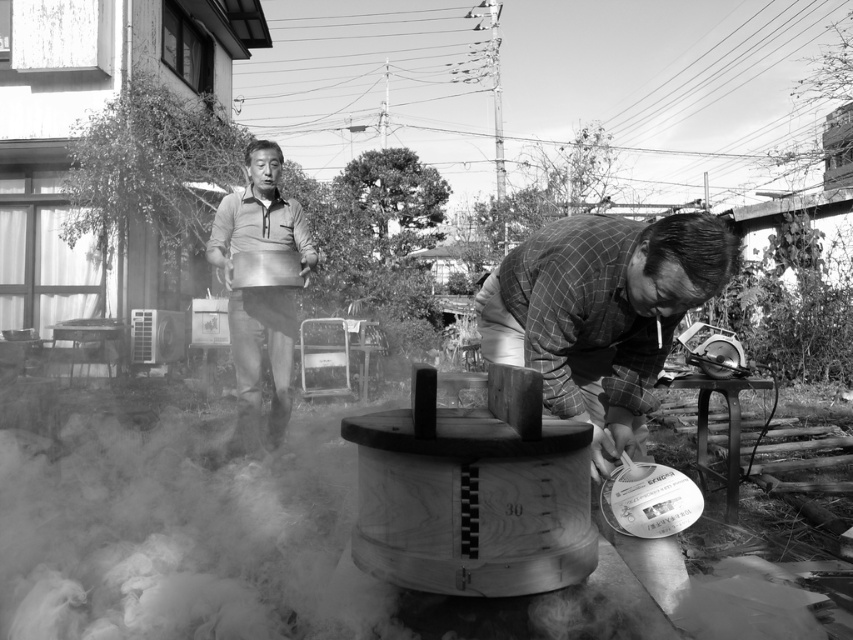
You are standing in the backyard and want to hand a tool to both the wooden plaid shirt at lower right and the matte gray shirt at upper center. Which person should you approach first to ensure you can reach them without moving too far?

You should approach the wooden plaid shirt at lower right first because they are closer to you than the matte gray shirt at upper center, so you can reach them without moving as much.

You are standing in the backyard and see the wooden plaid shirt at lower right and the matte gray shirt at upper center. Which one is positioned more to the right side of the scene?

The wooden plaid shirt at lower right is positioned more to the right side of the scene than the matte gray shirt at upper center.